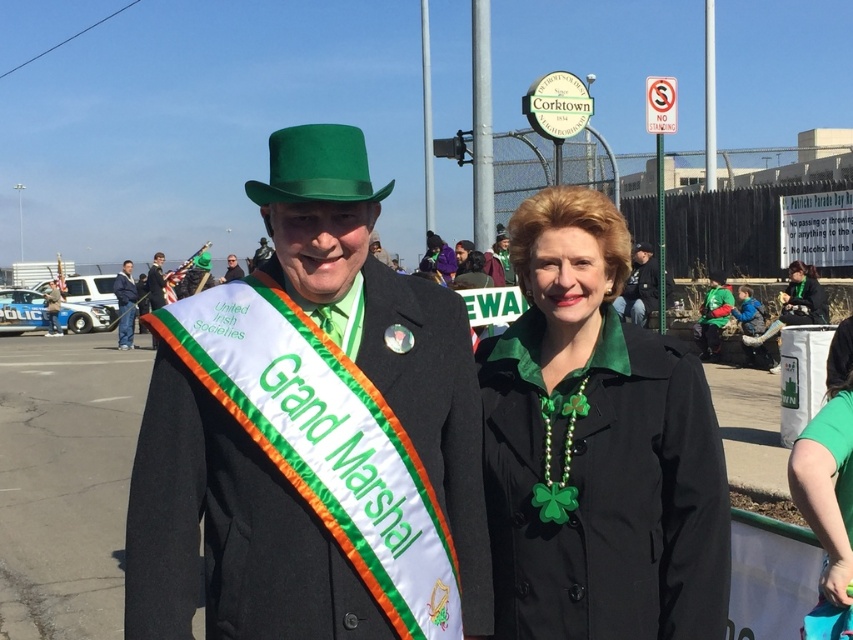
You are at the St. Patrick parade and want to take a photo of the two points in the image. Which point is closer to you, point (151, 289) or point (242, 272)?

Point (151, 289) is closer to the viewer than point (242, 272).

Based on the provided scene description, where is the black matte coat at center positioned in relation to the other elements?

The black matte coat at center is located at point (596,448) in the image coordinates.